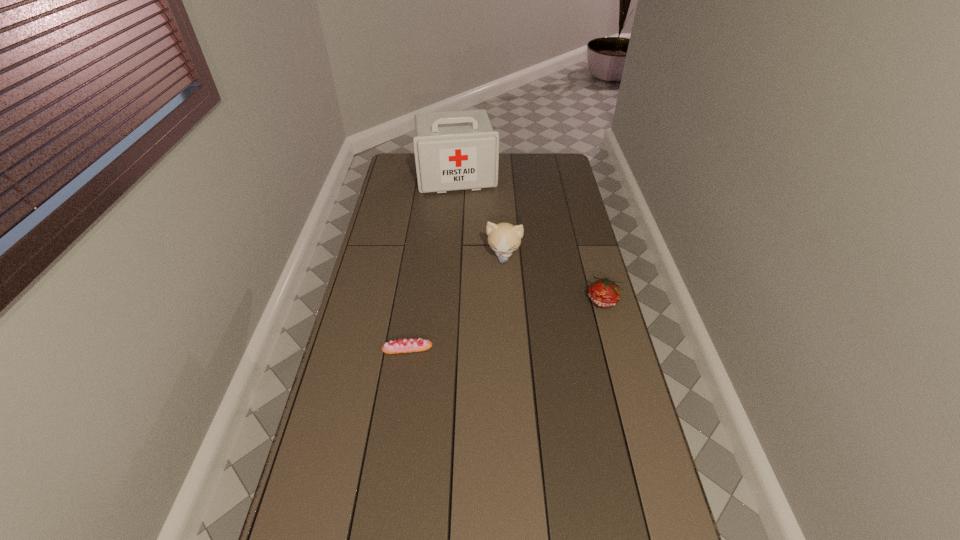
In order to click on empty location between the tallest object and the second farthest object in this screenshot , I will do `click(480, 216)`.

Identify the location of free spot between the first-aid kit and the nearest object. [x=432, y=262].

Image resolution: width=960 pixels, height=540 pixels. In order to click on vacant point located between the kitten and the nearest object in this screenshot , I will do `click(455, 302)`.

The image size is (960, 540). I want to click on empty space between the farthest object and the nearest object, so click(432, 262).

At what (x,y) coordinates should I click in order to perform the action: click on free spot between the second farthest object and the shortest object. Please return your answer as a coordinate pair (x, y). This screenshot has height=540, width=960. Looking at the image, I should click on (455, 302).

Where is `vacant space that is in between the first-aid kit and the nearest object`? vacant space that is in between the first-aid kit and the nearest object is located at coordinates (432, 262).

This screenshot has height=540, width=960. Identify the location of free point between the kitten and the farthest object. (480, 216).

At what (x,y) coordinates should I click in order to perform the action: click on object identified as the second closest to the third tallest object. Please return your answer as a coordinate pair (x, y). Looking at the image, I should click on (413, 345).

Where is `object that is the second closest one to the farthest object`? The image size is (960, 540). object that is the second closest one to the farthest object is located at coordinates (603, 292).